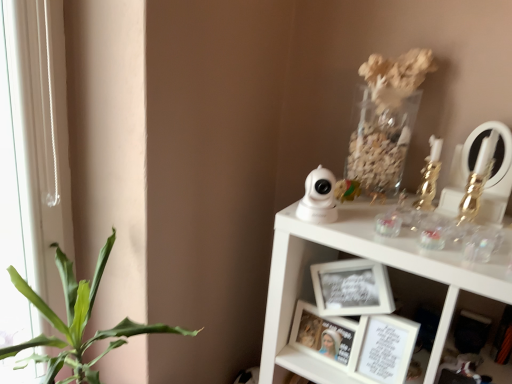
Question: From the image's perspective, is white matte picture frame at lower center, placed as the second picture frame when sorted from left to right, located beneath gold metallic candlestick at upper right, which ranks as the first toy in right-to-left order?

Choices:
 (A) yes
 (B) no

Answer: (A)

Question: Is gold metallic candlestick at upper right, the 2th toy viewed from the left, a part of white matte picture frame at lower center, placed as the second picture frame when sorted from left to right?

Choices:
 (A) no
 (B) yes

Answer: (A)

Question: From a real-world perspective, is white matte picture frame at lower center, which is counted as the first picture frame, starting from the right, under gold metallic candlestick at upper right, the 2th toy viewed from the left?

Choices:
 (A) yes
 (B) no

Answer: (A)

Question: Is white matte picture frame at lower center, placed as the second picture frame when sorted from left to right, to the left of gold metallic candlestick at upper right, the 2th toy viewed from the left, from the viewer's perspective?

Choices:
 (A) yes
 (B) no

Answer: (A)

Question: Does white matte picture frame at lower center, placed as the second picture frame when sorted from left to right, have a smaller size compared to gold metallic candlestick at upper right, the 2th toy viewed from the left?

Choices:
 (A) yes
 (B) no

Answer: (B)

Question: Is white matte picture frame at lower center, which is counted as the first picture frame, starting from the right, bigger than gold metallic candlestick at upper right, which ranks as the first toy in right-to-left order?

Choices:
 (A) no
 (B) yes

Answer: (B)

Question: From the image's perspective, is white matte picture frame at lower center, which is counted as the first picture frame, starting from the right, located beneath white glossy security camera at upper right, which is counted as the second toy, starting from the right?

Choices:
 (A) no
 (B) yes

Answer: (B)

Question: Does white matte picture frame at lower center, which is counted as the first picture frame, starting from the right, appear on the left side of white glossy security camera at upper right, arranged as the 1th toy when viewed from the left?

Choices:
 (A) no
 (B) yes

Answer: (A)

Question: Are white matte picture frame at lower center, which is counted as the first picture frame, starting from the right, and white glossy security camera at upper right, which is counted as the second toy, starting from the right, located far from each other?

Choices:
 (A) yes
 (B) no

Answer: (B)

Question: Is white matte picture frame at lower center, which is counted as the first picture frame, starting from the right, in contact with white glossy security camera at upper right, which is counted as the second toy, starting from the right?

Choices:
 (A) no
 (B) yes

Answer: (A)

Question: Is white matte picture frame at lower center, placed as the second picture frame when sorted from left to right, facing away from white glossy security camera at upper right, which is counted as the second toy, starting from the right?

Choices:
 (A) no
 (B) yes

Answer: (A)

Question: Would you say white matte picture frame at lower center, placed as the second picture frame when sorted from left to right, contains white glossy security camera at upper right, arranged as the 1th toy when viewed from the left?

Choices:
 (A) no
 (B) yes

Answer: (A)

Question: Is white glossy security camera at upper right, which is counted as the second toy, starting from the right, completely or partially inside matte white picture frame at center, the 2th picture frame in the right-to-left sequence?

Choices:
 (A) yes
 (B) no

Answer: (B)